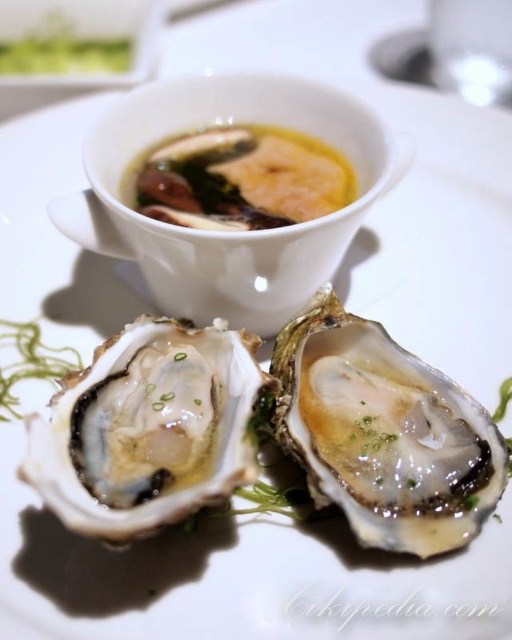
Consider the image. Who is higher up, glistening white oyster at center or shiny white oyster at center?

shiny white oyster at center is higher up.

Is glistening white oyster at center wider than shiny white oyster at center?

Correct, the width of glistening white oyster at center exceeds that of shiny white oyster at center.

This screenshot has height=640, width=512. Describe the element at coordinates (384, 433) in the screenshot. I see `glistening white oyster at center` at that location.

The width and height of the screenshot is (512, 640). I want to click on glistening white oyster at center, so click(x=384, y=433).

Which of these two, shiny white oyster at center or yellow creamy broth at upper center, stands shorter?

yellow creamy broth at upper center

Is point (144, 472) behind point (318, 173)?

No, it is in front of (318, 173).

Does point (67, 524) lie behind point (298, 172)?

No, it is in front of (298, 172).

At what (x,y) coordinates should I click in order to perform the action: click on shiny white oyster at center. Please return your answer as a coordinate pair (x, y). Looking at the image, I should click on click(x=147, y=429).

Is glistening white oyster at center smaller than yellow creamy broth at upper center?

Incorrect, glistening white oyster at center is not smaller in size than yellow creamy broth at upper center.

Is glistening white oyster at center thinner than yellow creamy broth at upper center?

Yes.

Between point (278, 376) and point (203, 216), which one is positioned behind?

Positioned behind is point (203, 216).

The width and height of the screenshot is (512, 640). I want to click on glistening white oyster at center, so (384, 433).